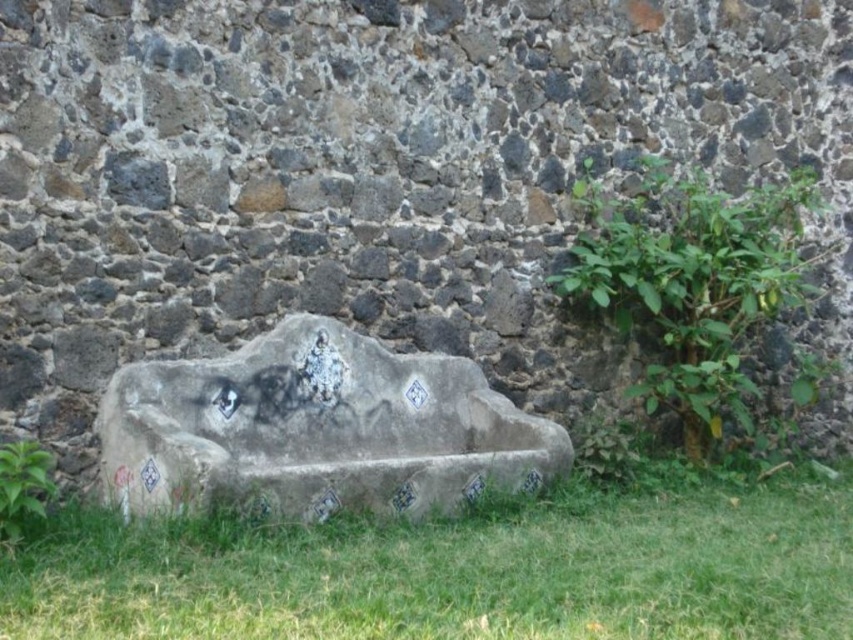
You are standing in front of a stone bench with a rough stone wall behind it. There is a point at coordinates (316, 429). Based on the scene description, where is this point located?

The point at coordinates (316, 429) is located on the gray concrete bench at center.

You are standing at the stone bench in the image. There are two points marked on the bench. One is at coordinate point [245,408] and the other is at point [694,260]. Which point is closer to you?

Point [245,408] is in front of point [694,260], so it is closer to you.